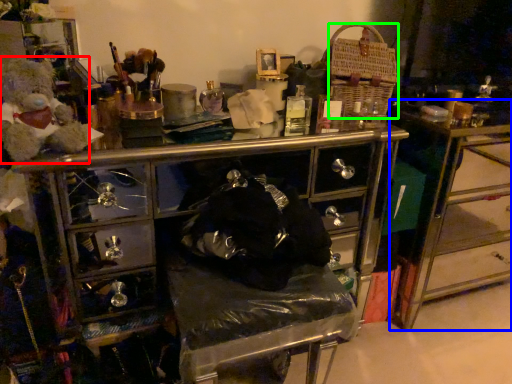
Question: Which is farther away from teddy (highlighted by a red box)? table (highlighted by a blue box) or crate (highlighted by a green box)?

Choices:
 (A) table
 (B) crate

Answer: (A)